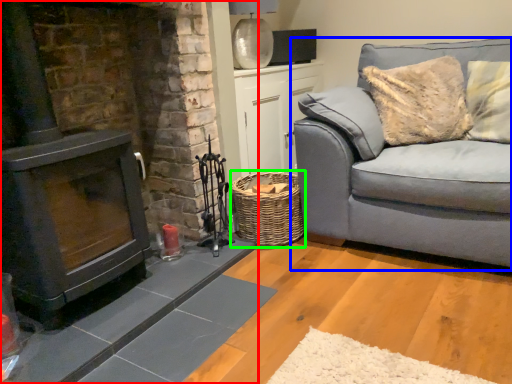
Question: Estimate the real-world distances between objects in this image. Which object is farther from fireplace (highlighted by a red box), studio couch (highlighted by a blue box) or basket (highlighted by a green box)?

Choices:
 (A) studio couch
 (B) basket

Answer: (A)